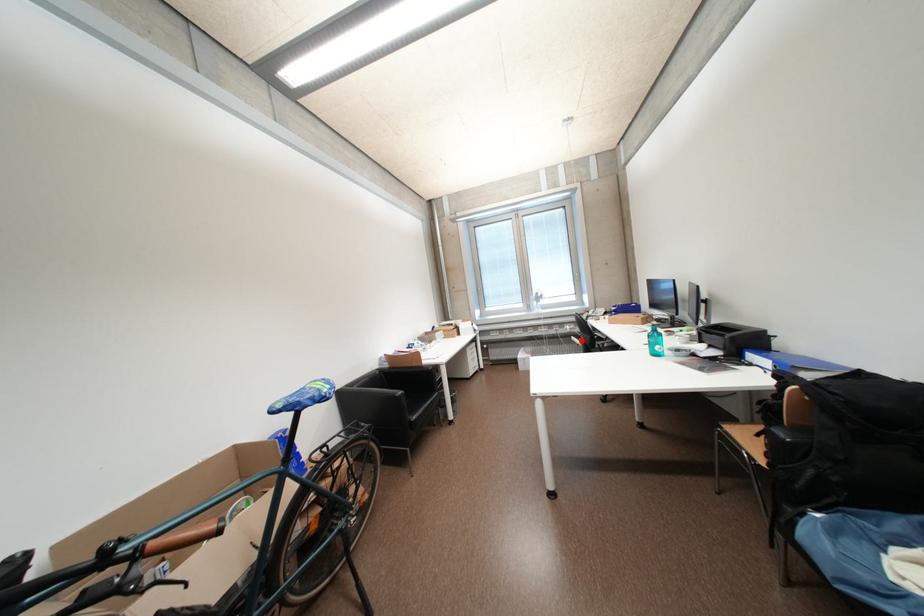
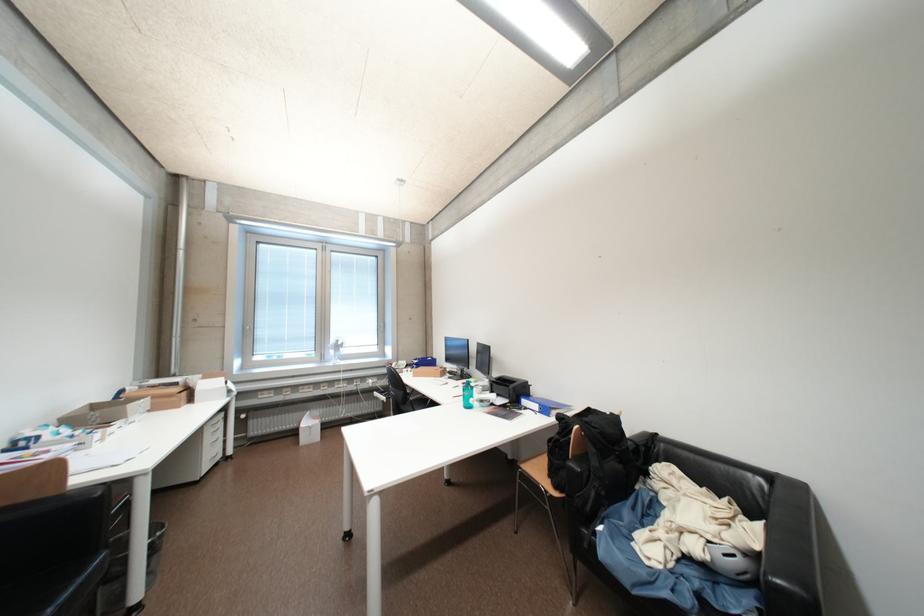
Question: I am providing you with two images of the same scene from different viewpoints. Image1 has a red point marked. In image2, the corresponding 3D location appears at what relative position? Reply with the corresponding letter.

Choices:
 (A) Closer
 (B) Farther

Answer: (B)